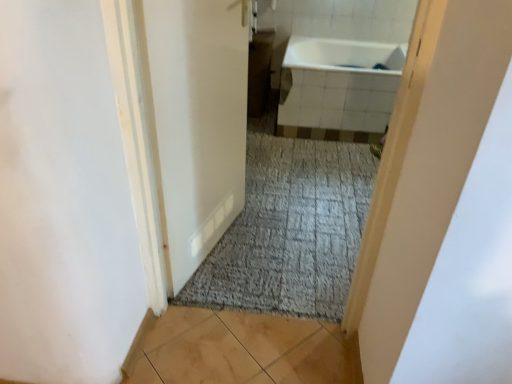
Locate an element on the screen. Image resolution: width=512 pixels, height=384 pixels. blank space situated above light brown tile at lower center (from a real-world perspective) is located at coordinates (215, 352).